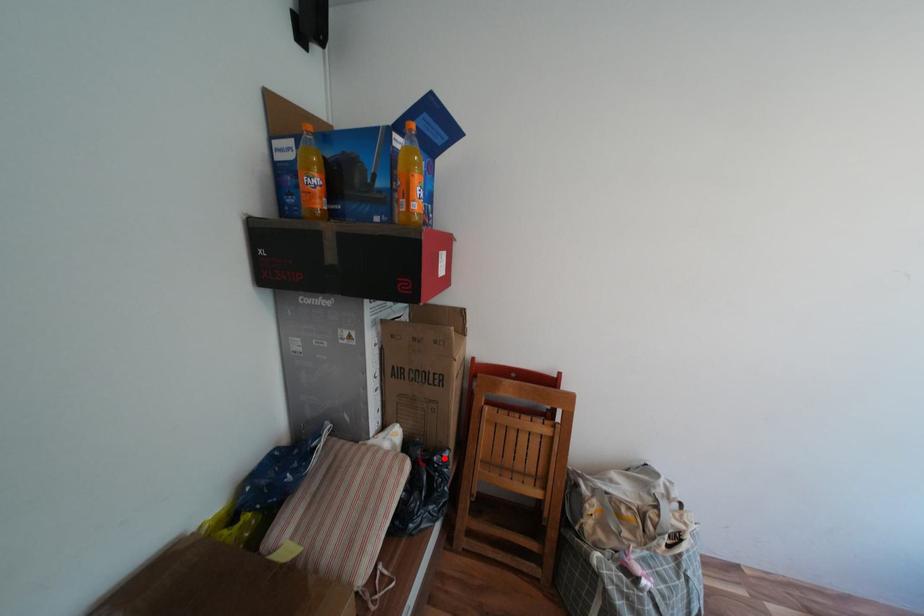
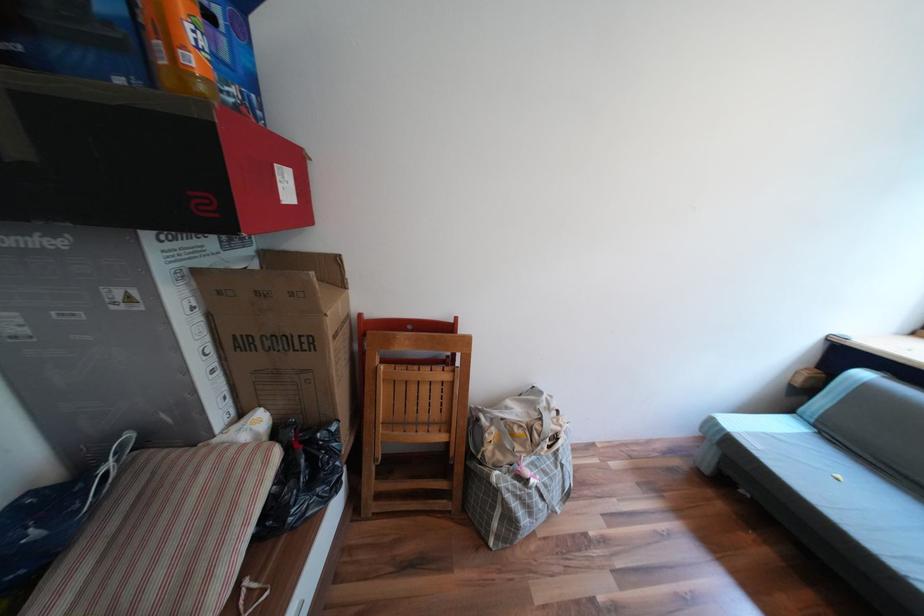
Question: I am providing you with two images of the same scene from different viewpoints. Given a red point in image1, look at the same physical point in image2. Is it:

Choices:
 (A) Closer to the viewpoint
 (B) Farther from the viewpoint

Answer: (A)